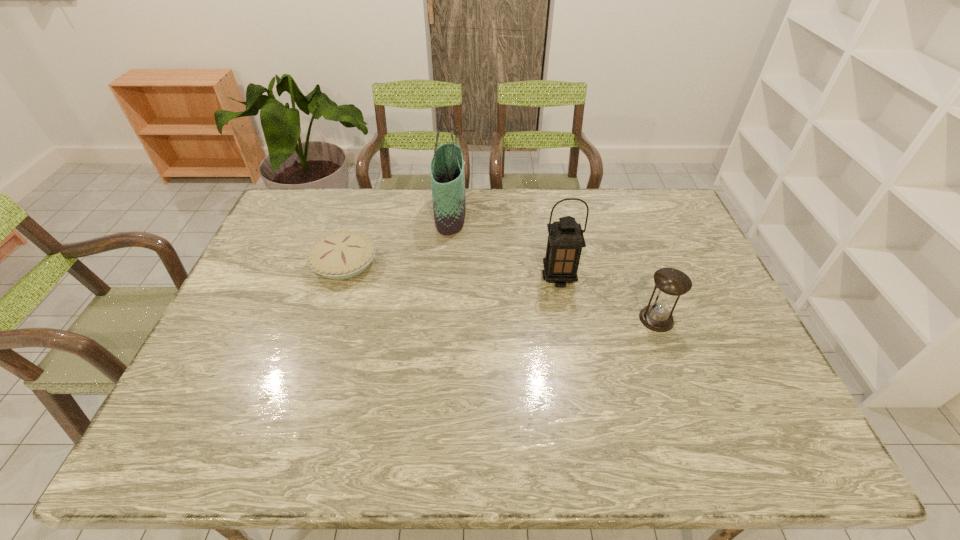
What are the coordinates of `tote bag` in the screenshot? It's located at (447, 175).

Where is `the second object from left to right`? The width and height of the screenshot is (960, 540). the second object from left to right is located at coordinates (447, 175).

In order to click on lantern in this screenshot , I will do `click(565, 241)`.

Locate an element on the screen. the second object from right to left is located at coordinates (565, 241).

Locate an element on the screen. The image size is (960, 540). the rightmost object is located at coordinates (671, 283).

The image size is (960, 540). What are the coordinates of `the nearest object` in the screenshot? It's located at (671, 283).

Locate an element on the screen. The image size is (960, 540). the leftmost object is located at coordinates (341, 255).

I want to click on the shortest object, so 341,255.

Locate an element on the screen. This screenshot has height=540, width=960. free region located on the left of the farthest object is located at coordinates (403, 213).

Locate an element on the screen. The height and width of the screenshot is (540, 960). free space located 0.270m on the right of the second tallest object is located at coordinates (665, 278).